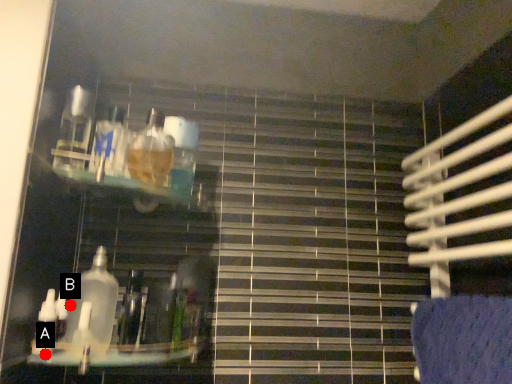
Question: Two points are circled on the image, labeled by A and B beside each circle. Which point is closer to the camera?

Choices:
 (A) A is closer
 (B) B is closer

Answer: (A)